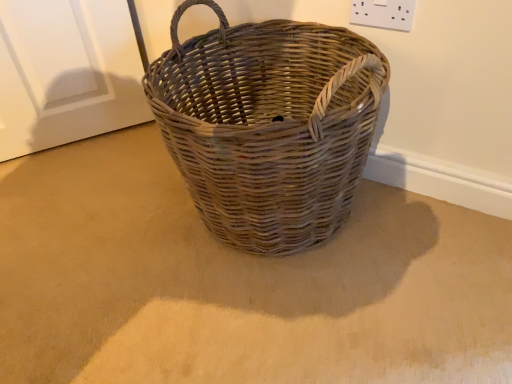
Image resolution: width=512 pixels, height=384 pixels. In order to click on natural woven picnic basket at center in this screenshot , I will do `click(268, 125)`.

Describe the element at coordinates (268, 125) in the screenshot. I see `natural woven picnic basket at center` at that location.

Describe the element at coordinates (383, 14) in the screenshot. This screenshot has width=512, height=384. I see `white plastic socket at upper right` at that location.

Locate an element on the screen. This screenshot has height=384, width=512. white plastic socket at upper right is located at coordinates (383, 14).

Locate an element on the screen. natural woven picnic basket at center is located at coordinates (268, 125).

Can you confirm if natural woven picnic basket at center is positioned to the right of white plastic socket at upper right?

No.

Considering the positions of objects natural woven picnic basket at center and white plastic socket at upper right in the image provided, who is in front, natural woven picnic basket at center or white plastic socket at upper right?

natural woven picnic basket at center is closer to the camera.

Is point (243, 200) farther from camera compared to point (355, 13)?

That is False.

From the image's perspective, is natural woven picnic basket at center positioned above or below white plastic socket at upper right?

natural woven picnic basket at center is below white plastic socket at upper right.

From a real-world perspective, is natural woven picnic basket at center positioned under white plastic socket at upper right based on gravity?

Indeed, from a real-world perspective, natural woven picnic basket at center is positioned beneath white plastic socket at upper right.

Which of these two, natural woven picnic basket at center or white plastic socket at upper right, is thinner?

white plastic socket at upper right.

Does natural woven picnic basket at center have a greater height compared to white plastic socket at upper right?

Yes, natural woven picnic basket at center is taller than white plastic socket at upper right.

Between natural woven picnic basket at center and white plastic socket at upper right, which one has larger size?

natural woven picnic basket at center.

Could white plastic socket at upper right be considered to be inside natural woven picnic basket at center?

No, natural woven picnic basket at center does not contain white plastic socket at upper right.

Is natural woven picnic basket at center next to white plastic socket at upper right?

natural woven picnic basket at center and white plastic socket at upper right are not in contact.

Could you tell me if natural woven picnic basket at center is facing white plastic socket at upper right?

No.

How different are the orientations of natural woven picnic basket at center and white plastic socket at upper right in degrees?

0.198 degrees.

How much distance is there between natural woven picnic basket at center and white plastic socket at upper right?

natural woven picnic basket at center is 14.13 inches away from white plastic socket at upper right.

The image size is (512, 384). I want to click on picnic basket located below the white plastic socket at upper right (from the image's perspective), so pos(268,125).

From the picture: Which is more to the left, white plastic socket at upper right or natural woven picnic basket at center?

From the viewer's perspective, natural woven picnic basket at center appears more on the left side.

Is white plastic socket at upper right in front of or behind natural woven picnic basket at center in the image?

white plastic socket at upper right is positioned farther from the viewer than natural woven picnic basket at center.

Considering the points (353, 20) and (321, 175), which point is behind, point (353, 20) or point (321, 175)?

The point (353, 20) is more distant.

From the image's perspective, which is above, white plastic socket at upper right or natural woven picnic basket at center?

white plastic socket at upper right is shown above in the image.

From a real-world perspective, is white plastic socket at upper right beneath natural woven picnic basket at center?

No, from a real-world perspective, white plastic socket at upper right is not under natural woven picnic basket at center.

Considering the relative sizes of white plastic socket at upper right and natural woven picnic basket at center in the image provided, is white plastic socket at upper right wider than natural woven picnic basket at center?

In fact, white plastic socket at upper right might be narrower than natural woven picnic basket at center.

Is white plastic socket at upper right taller than natural woven picnic basket at center?

No, white plastic socket at upper right is not taller than natural woven picnic basket at center.

Is white plastic socket at upper right smaller than natural woven picnic basket at center?

Yes.

Is white plastic socket at upper right positioned beyond the bounds of natural woven picnic basket at center?

Yes, white plastic socket at upper right is located beyond the bounds of natural woven picnic basket at center.

Does white plastic socket at upper right touch natural woven picnic basket at center?

No, white plastic socket at upper right is not beside natural woven picnic basket at center.

Could you tell me if white plastic socket at upper right is facing natural woven picnic basket at center?

Yes, white plastic socket at upper right is turned towards natural woven picnic basket at center.

How different are the orientations of white plastic socket at upper right and natural woven picnic basket at center in degrees?

There is a 0.198-degree angle between the facing directions of white plastic socket at upper right and natural woven picnic basket at center.

Where is `electric outlet that appears above the natural woven picnic basket at center (from a real-world perspective)`? The width and height of the screenshot is (512, 384). electric outlet that appears above the natural woven picnic basket at center (from a real-world perspective) is located at coordinates (383, 14).

Where is `electric outlet located above the natural woven picnic basket at center (from the image's perspective)`? The width and height of the screenshot is (512, 384). electric outlet located above the natural woven picnic basket at center (from the image's perspective) is located at coordinates (383, 14).

Find the location of a particular element. This screenshot has width=512, height=384. picnic basket below the white plastic socket at upper right (from a real-world perspective) is located at coordinates (268, 125).